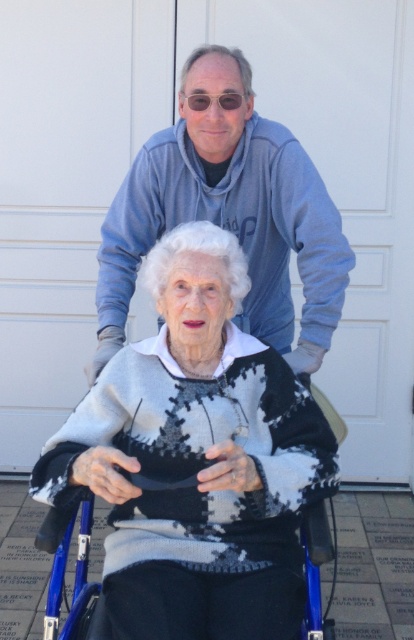
You are a photographer setting up for a portrait session. You want to ensure the knitted sweater at center is in focus while keeping the background slightly blurred. Given that the sweater is 5.40 feet away from the camera, what adjustment should you make to the camera lens?

To ensure the knitted sweater at center is in focus and blur the background, adjust the camera lens to a smaller aperture setting, which increases depth of field, allowing the sweater at 5.40 feet to be sharp while the background becomes less focused.

You are a delivery person who needs to place a package between the matte blue hoodie at upper center and the blue plastic wheelchair at center. The package is 1 meter long. Will it fit in the space between them?

The distance between the matte blue hoodie at upper center and the blue plastic wheelchair at center is 93.28 centimeters. Since the package is 1 meter long, which is longer than the available space, it will not fit between them.

You are a photographer setting up a shoot in front of a white garage door. You notice the knitted sweater at center and the blue plastic wheelchair at center. Which object should you focus on first to ensure it appears sharp in the photo?

The knitted sweater at center is closer to the viewer than the blue plastic wheelchair at center, so you should focus on the knitted sweater at center first to ensure it appears sharp in the photo.